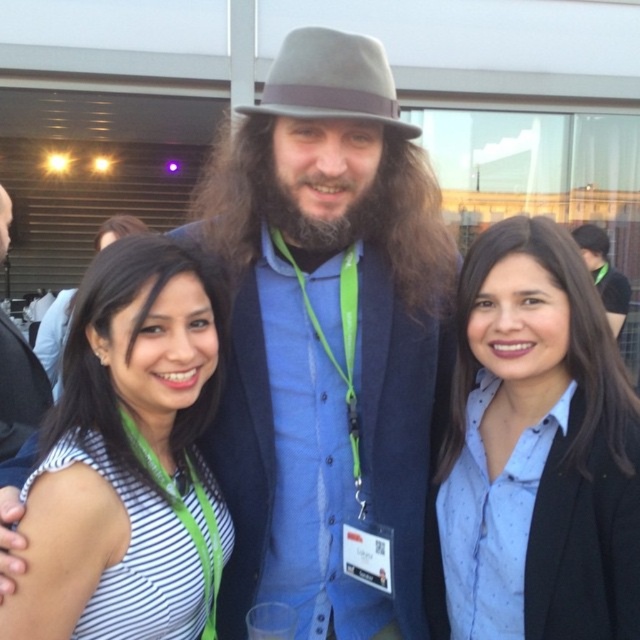
You are a photographer at a social event. You need to arrange two people wearing the blue dotted shirt at center and the white striped shirt at center so that they are facing the camera. According to the scene, which shirt should be placed to the left to match the original image?

The white striped shirt at center should be placed to the left because the blue dotted shirt at center is positioned on the right side of white striped shirt at center in the original image.

Consider the image. You are organizing a clothing donation drive and need to categorize items by size. You have two shirts in front of you, the blue dotted shirt at center and the white striped shirt at center. Which shirt is narrower?

The blue dotted shirt at center is narrower than the white striped shirt at center.

You are a photographer standing at the center of the scene. You need to adjust your camera focus to capture both the matte gray fedora at center and the dark brown hair at center clearly. Given that your camera has a depth of field that can cover objects within a 10 feet range, will both subjects be in focus?

The matte gray fedora at center is 11.30 feet away from dark brown hair at center. Since the distance between them exceeds the camera lens depth of field range of 10 feet, it is unlikely both will be in focus simultaneously.